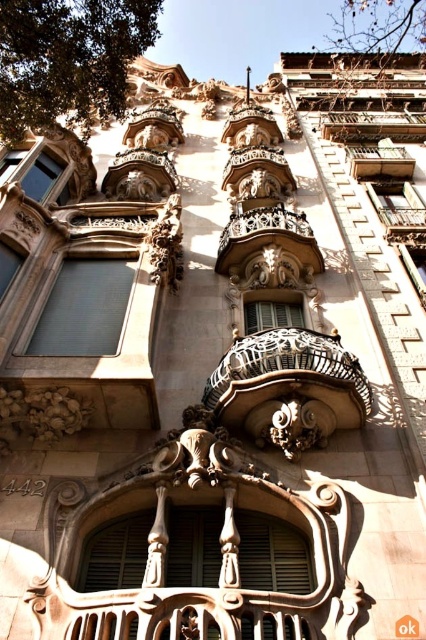
Is polished bronze balcony at center positioned behind wooden lattice balcony at center?

No, polished bronze balcony at center is in front of wooden lattice balcony at center.

Between polished bronze balcony at center and wooden lattice balcony at center, which one is positioned lower?

polished bronze balcony at center

Who is more distant from viewer, (313,260) or (411,177)?

The point (411,177) is more distant.

This screenshot has width=426, height=640. What are the coordinates of `polished bronze balcony at center` in the screenshot? It's located at (267, 240).

Between matte gray window at center and wooden lattice balcony at center, which one has less height?

With less height is matte gray window at center.

Does point (77, 275) come behind point (351, 154)?

No.

The height and width of the screenshot is (640, 426). I want to click on matte gray window at center, so click(x=85, y=308).

Which is behind, point (382, 166) or point (42, 164)?

The point (382, 166) is more distant.

Between wooden lattice balcony at center and matte glass window at upper left, which one appears on the left side from the viewer's perspective?

From the viewer's perspective, matte glass window at upper left appears more on the left side.

This screenshot has width=426, height=640. Find the location of `wooden lattice balcony at center`. wooden lattice balcony at center is located at coordinates (379, 161).

Identify the location of wooden lattice balcony at center. This screenshot has height=640, width=426. (379, 161).